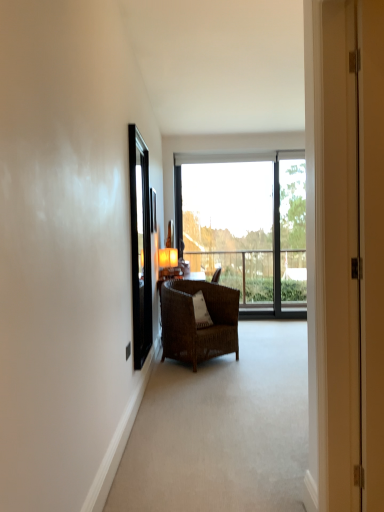
Where is `transparent glass window at center`? transparent glass window at center is located at coordinates (246, 226).

This screenshot has width=384, height=512. Describe the element at coordinates (140, 245) in the screenshot. I see `black glossy screen door at left` at that location.

This screenshot has width=384, height=512. What do you see at coordinates (195, 321) in the screenshot?
I see `brown wicker chair at center` at bounding box center [195, 321].

This screenshot has width=384, height=512. In order to click on matte orange lampshade at center in this screenshot , I will do `click(168, 263)`.

Describe the element at coordinates (168, 263) in the screenshot. This screenshot has height=512, width=384. I see `matte orange lampshade at center` at that location.

Find the location of `transparent glass window at center`. transparent glass window at center is located at coordinates (246, 226).

Would you say black glossy screen door at left is outside matte orange lampshade at center?

black glossy screen door at left is positioned outside matte orange lampshade at center.

Which of these two, black glossy screen door at left or matte orange lampshade at center, is wider?

matte orange lampshade at center is wider.

Is black glossy screen door at left in front of matte orange lampshade at center?

Yes, it is in front of matte orange lampshade at center.

How many degrees apart are the facing directions of brown wicker chair at center and matte white door at center?

The angle between the facing direction of brown wicker chair at center and the facing direction of matte white door at center is 133 degrees.

From a real-world perspective, is brown wicker chair at center under matte white door at center?

Yes, from a real-world perspective, brown wicker chair at center is below matte white door at center.

Considering the sizes of brown wicker chair at center and matte white door at center in the image, is brown wicker chair at center taller or shorter than matte white door at center?

Clearly, brown wicker chair at center is shorter compared to matte white door at center.

Is matte orange lampshade at center wider or thinner than matte white door at center?

matte orange lampshade at center is wider than matte white door at center.

From the image's perspective, between matte orange lampshade at center and matte white door at center, who is located below?

matte orange lampshade at center.

Does matte orange lampshade at center have a smaller size compared to matte white door at center?

Yes, matte orange lampshade at center is smaller than matte white door at center.

In the scene shown: Does matte orange lampshade at center come in front of matte white door at center?

No.

From the picture: Which is closer to the camera, (x=147, y=205) or (x=222, y=248)?

Point (x=147, y=205) appears to be closer to the viewer than point (x=222, y=248).

Between black glossy screen door at left and transparent glass window at center, which one has more height?

With more height is transparent glass window at center.

Could you tell me if black glossy screen door at left is facing transparent glass window at center?

No, black glossy screen door at left is not turned towards transparent glass window at center.

From a real-world perspective, who is located lower, transparent glass window at center or black glossy screen door at left?

transparent glass window at center.

Can you confirm if transparent glass window at center is taller than black glossy screen door at left?

Correct, transparent glass window at center is much taller as black glossy screen door at left.

In the scene shown: Is transparent glass window at center positioned far away from black glossy screen door at left?

Yes, transparent glass window at center is far from black glossy screen door at left.

How different are the orientations of transparent glass window at center and black glossy screen door at left in degrees?

They differ by 89.5 degrees in their facing directions.

Considering the relative positions of matte white door at center and matte orange lampshade at center in the image provided, is matte white door at center to the left or to the right of matte orange lampshade at center?

Based on their positions, matte white door at center is located to the right of matte orange lampshade at center.

In the scene shown: From a real-world perspective, is matte white door at center positioned above or below matte orange lampshade at center?

From a real-world perspective, matte white door at center is physically above matte orange lampshade at center.

Who is bigger, matte white door at center or matte orange lampshade at center?

matte white door at center.

Can we say transparent glass window at center lies outside matte orange lampshade at center?

transparent glass window at center is positioned outside matte orange lampshade at center.

Based on the photo, how far apart are transparent glass window at center and matte orange lampshade at center?

The distance of transparent glass window at center from matte orange lampshade at center is 1.52 meters.

Considering the relative positions of transparent glass window at center and matte orange lampshade at center in the image provided, is transparent glass window at center to the left of matte orange lampshade at center from the viewer's perspective?

Incorrect, transparent glass window at center is not on the left side of matte orange lampshade at center.

How many degrees apart are the facing directions of transparent glass window at center and matte orange lampshade at center?

The angle between the facing direction of transparent glass window at center and the facing direction of matte orange lampshade at center is 149 degrees.

Locate an element on the screen. The image size is (384, 512). lamp directly beneath the black glossy screen door at left (from a real-world perspective) is located at coordinates (168, 263).

Locate an element on the screen. chair on the left of matte white door at center is located at coordinates (195, 321).

Estimate the real-world distances between objects in this image. Which object is further from matte white door at center, matte orange lampshade at center or transparent glass window at center?

Based on the image, transparent glass window at center appears to be further to matte white door at center.

Looking at the image, which one is located closer to brown wicker chair at center, matte white door at center or black glossy screen door at left?

The object closer to brown wicker chair at center is black glossy screen door at left.

Looking at the image, which one is located closer to matte white door at center, brown wicker chair at center or black glossy screen door at left?

Among the two, black glossy screen door at left is located nearer to matte white door at center.

When comparing their distances from matte white door at center, does transparent glass window at center or matte orange lampshade at center seem further?

The object further to matte white door at center is transparent glass window at center.

Based on their spatial positions, is matte orange lampshade at center or transparent glass window at center closer to black glossy screen door at left?

matte orange lampshade at center.

From the image, which object appears to be farther from brown wicker chair at center, black glossy screen door at left or matte orange lampshade at center?

Based on the image, matte orange lampshade at center appears to be further to brown wicker chair at center.

When comparing their distances from matte orange lampshade at center, does brown wicker chair at center or transparent glass window at center seem further?

transparent glass window at center is further to matte orange lampshade at center.

Estimate the real-world distances between objects in this image. Which object is closer to matte white door at center, matte orange lampshade at center or brown wicker chair at center?

The object closer to matte white door at center is brown wicker chair at center.

You are a GUI agent. You are given a task and a screenshot of the screen. Output one action in this format:
    pyautogui.click(x=<x>, y=<y>)
    Task: Click on the screen door positioned between matte white door at center and brown wicker chair at center from near to far
    
    Given the screenshot: What is the action you would take?
    click(140, 245)

This screenshot has width=384, height=512. I want to click on chair between black glossy screen door at left and matte orange lampshade at center along the z-axis, so coord(195,321).

Locate an element on the screen. The width and height of the screenshot is (384, 512). chair between matte white door at center and matte orange lampshade at center from front to back is located at coordinates (195, 321).

The height and width of the screenshot is (512, 384). In order to click on lamp located between brown wicker chair at center and transparent glass window at center in the depth direction in this screenshot , I will do `click(168, 263)`.